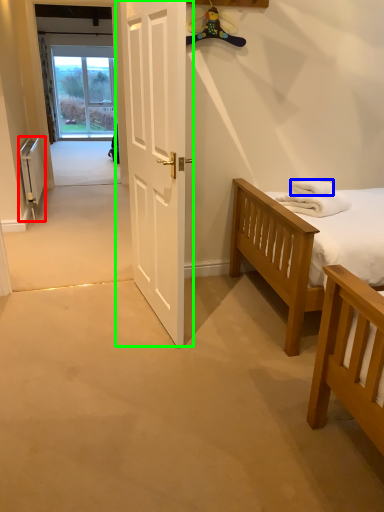
Question: Considering the real-world distances, which object is farthest from radiator (highlighted by a red box)? towel/napkin (highlighted by a blue box) or door (highlighted by a green box)?

Choices:
 (A) towel/napkin
 (B) door

Answer: (A)